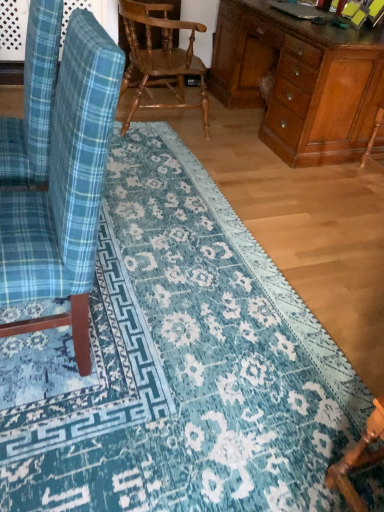
Question: Is wooden armchair at right to the right of blue plaid fabric chair at left, the second chair in the top-to-bottom sequence, from the viewer's perspective?

Choices:
 (A) no
 (B) yes

Answer: (B)

Question: Is wooden armchair at right not near blue plaid fabric chair at left, which is the 2th chair from bottom to top?

Choices:
 (A) no
 (B) yes

Answer: (B)

Question: From a real-world perspective, does wooden armchair at right stand above blue plaid fabric chair at left, which is the 2th chair from bottom to top?

Choices:
 (A) yes
 (B) no

Answer: (B)

Question: Is wooden armchair at right further to the viewer compared to blue plaid fabric chair at left, which is the 2th chair from bottom to top?

Choices:
 (A) yes
 (B) no

Answer: (A)

Question: Is wooden armchair at right positioned with its back to blue plaid fabric chair at left, which is the first chair from front to back?

Choices:
 (A) yes
 (B) no

Answer: (B)

Question: Does wooden armchair at right appear on the left side of blue plaid fabric chair at left, which is the first chair from front to back?

Choices:
 (A) no
 (B) yes

Answer: (A)

Question: Is wooden textured chair at center, arranged as the 3th chair when ordered from the bottom, wider than wooden chair at lower right, which is the 1th chair from bottom to top?

Choices:
 (A) no
 (B) yes

Answer: (B)

Question: Is wooden textured chair at center, arranged as the 3th chair when ordered from the bottom, not near wooden chair at lower right, placed as the 2th chair when sorted from front to back?

Choices:
 (A) yes
 (B) no

Answer: (A)

Question: Considering the relative sizes of wooden textured chair at center, positioned as the first chair in top-to-bottom order, and wooden chair at lower right, which is the 1th chair from bottom to top, in the image provided, is wooden textured chair at center, positioned as the first chair in top-to-bottom order, smaller than wooden chair at lower right, which is the 1th chair from bottom to top,?

Choices:
 (A) yes
 (B) no

Answer: (B)

Question: Does wooden textured chair at center, positioned as the first chair in top-to-bottom order, appear on the left side of wooden chair at lower right, which is the 2th chair in back-to-front order?

Choices:
 (A) yes
 (B) no

Answer: (A)

Question: Is wooden textured chair at center, which ranks as the 3th chair in front-to-back order, bigger than wooden chair at lower right, which is the 1th chair from bottom to top?

Choices:
 (A) no
 (B) yes

Answer: (B)

Question: Considering the relative sizes of wooden textured chair at center, positioned as the first chair in top-to-bottom order, and wooden chair at lower right, placed as the 2th chair when sorted from front to back, in the image provided, is wooden textured chair at center, positioned as the first chair in top-to-bottom order, shorter than wooden chair at lower right, placed as the 2th chair when sorted from front to back,?

Choices:
 (A) no
 (B) yes

Answer: (A)

Question: Does wooden desk at right appear on the right side of wooden chair at lower right, placed as the 2th chair when sorted from front to back?

Choices:
 (A) no
 (B) yes

Answer: (B)